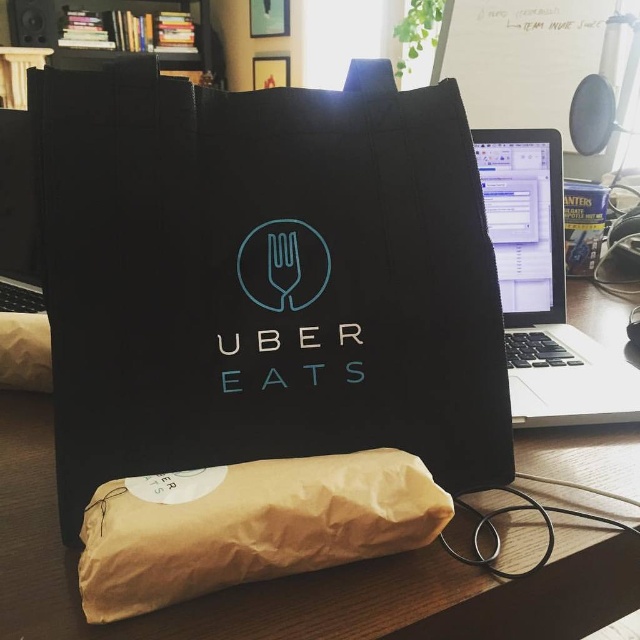
Who is shorter, black matte logo at center or teal plastic fork at center?

With less height is teal plastic fork at center.

At what (x,y) coordinates should I click in order to perform the action: click on black matte logo at center. Please return your answer as a coordinate pair (x, y). This screenshot has height=640, width=640. Looking at the image, I should click on (284, 266).

You are a GUI agent. You are given a task and a screenshot of the screen. Output one action in this format:
    pyautogui.click(x=<x>, y=<y>)
    Task: Click on the black matte logo at center
    
    Given the screenshot: What is the action you would take?
    pyautogui.click(x=284, y=266)

Which of these two, brown paper bag at lower center or black matte logo at center, stands shorter?

Standing shorter between the two is brown paper bag at lower center.

Does brown paper bag at lower center appear over black matte logo at center?

No.

Is point (164, 499) less distant than point (250, 273)?

Yes.

You are a GUI agent. You are given a task and a screenshot of the screen. Output one action in this format:
    pyautogui.click(x=<x>, y=<y>)
    Task: Click on the brown paper bag at lower center
    The height and width of the screenshot is (640, 640).
    Given the screenshot: What is the action you would take?
    pyautogui.click(x=248, y=525)

Is point (205, 580) closer to viewer compared to point (316, 284)?

That is True.

Can you confirm if brown paper bag at lower center is positioned below teal plastic fork at center?

Yes.

Does point (305, 552) lie behind point (308, 228)?

No, (305, 552) is closer to viewer.

In order to click on brown paper bag at lower center in this screenshot , I will do `click(248, 525)`.